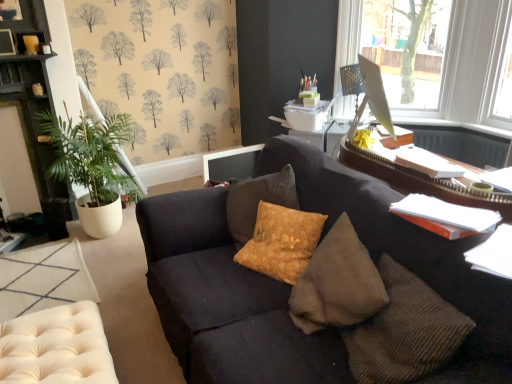
The width and height of the screenshot is (512, 384). I want to click on vacant area on top of matte cream tufted swivel chair at lower left (from a real-world perspective), so click(x=48, y=349).